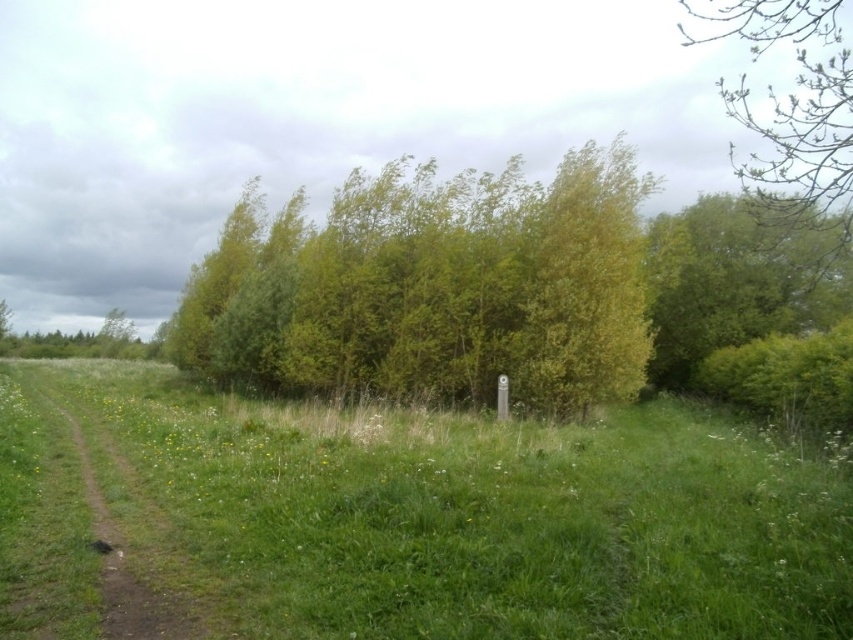
Can you confirm if green leafy trees at center is positioned to the left of brown dirt track at left?

Incorrect, green leafy trees at center is not on the left side of brown dirt track at left.

Who is more distant from viewer, (268, 296) or (57, 620)?

The point (268, 296) is more distant.

Who is more forward, (288, 310) or (32, 612)?

Point (32, 612) is more forward.

Where is `green leafy trees at center`? The width and height of the screenshot is (853, 640). green leafy trees at center is located at coordinates (434, 289).

Which of these two, green grassy field at center or brown dirt track at left, stands taller?

green grassy field at center is taller.

Between point (250, 609) and point (61, 545), which one is positioned in front?

Point (250, 609) is in front.

Where is `green grassy field at center`? This screenshot has height=640, width=853. green grassy field at center is located at coordinates (410, 516).

Does green leafy trees at center appear under green leafy tree at upper right?

No, green leafy trees at center is not below green leafy tree at upper right.

Does green leafy trees at center have a greater height compared to green leafy tree at upper right?

Yes, green leafy trees at center is taller than green leafy tree at upper right.

Between point (368, 218) and point (688, 236), which one is positioned in front?

Point (368, 218)

The height and width of the screenshot is (640, 853). In order to click on green leafy trees at center in this screenshot , I will do `click(434, 289)`.